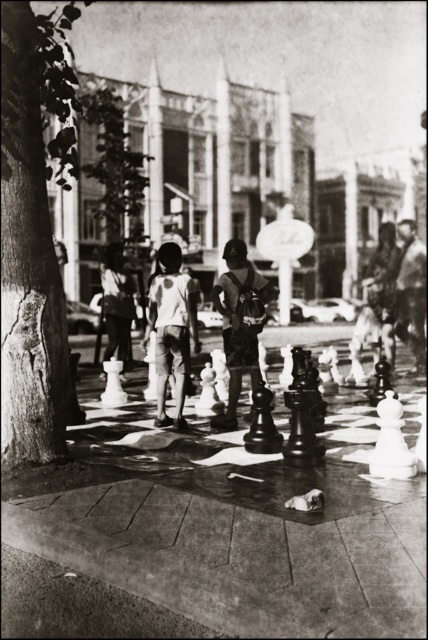
Can you confirm if light gray cotton shorts at center is wider than dark blue denim shorts at center?

Yes.

I want to click on light gray cotton shorts at center, so click(x=172, y=328).